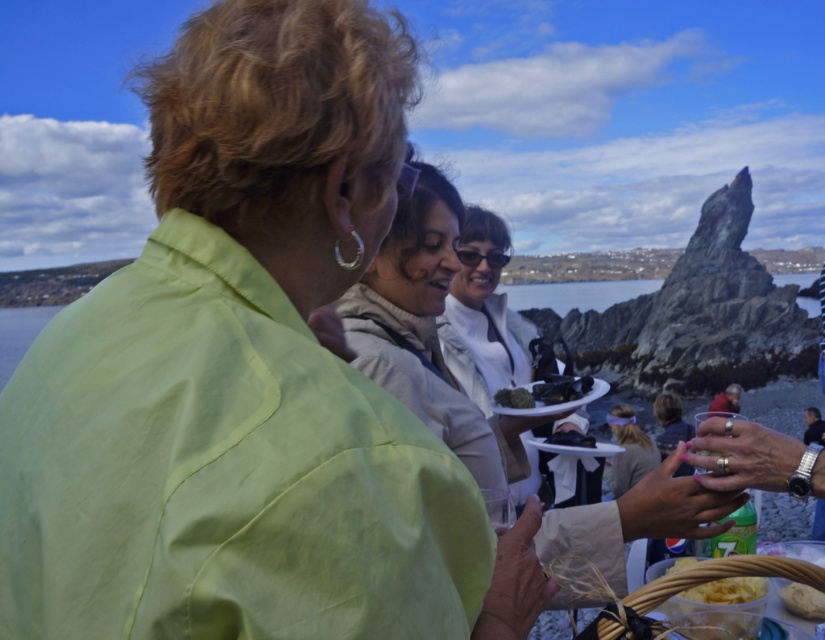
Question: Which point appears farthest from the camera in this image?

Choices:
 (A) (819, 595)
 (B) (726, 611)

Answer: (A)

Question: Which point is farther to the camera?

Choices:
 (A) (521, 404)
 (B) (809, 612)
 (C) (343, 298)
 (D) (580, 388)

Answer: (D)

Question: Which object appears farthest from the camera in this image?

Choices:
 (A) green leafy vegetable at center
 (B) translucent plastic container at lower right
 (C) light beige jacket at center
 (D) white matte bread at lower right

Answer: (A)

Question: From the image, what is the correct spatial relationship of white matte jacket at center in relation to white matte bread at lower right?

Choices:
 (A) right
 (B) left

Answer: (B)

Question: Does translucent plastic container at lower right have a greater width compared to smooth black plate at center?

Choices:
 (A) yes
 (B) no

Answer: (A)

Question: Is green leafy vegetable at center bigger than smooth black plate at center?

Choices:
 (A) no
 (B) yes

Answer: (A)